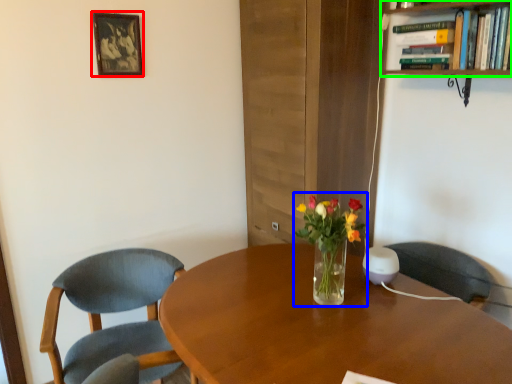
Question: Which object is the closest to the picture frame (highlighted by a red box)? Choose among these: floral arrangement (highlighted by a blue box) or bookcase (highlighted by a green box).

Choices:
 (A) floral arrangement
 (B) bookcase

Answer: (A)